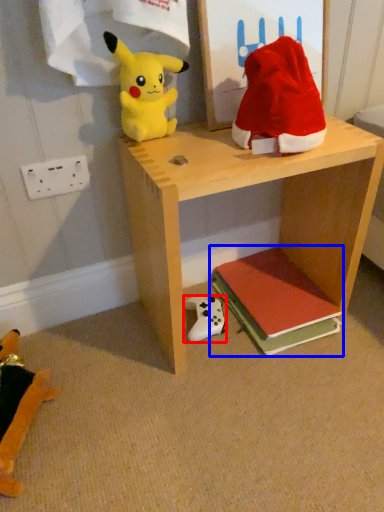
Question: Which object is further to the camera taking this photo, toy (highlighted by a red box) or book (highlighted by a blue box)?

Choices:
 (A) toy
 (B) book

Answer: (A)